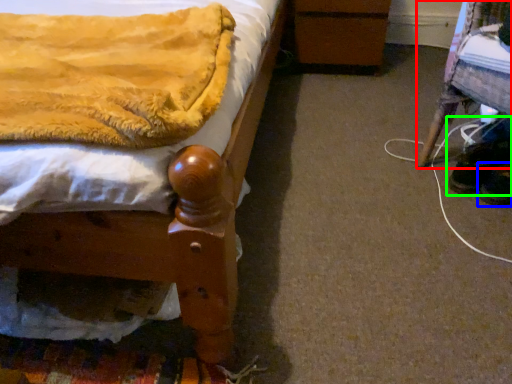
Question: Based on their relative distances, which object is farther from furniture (highlighted by a red box)? Choose from footwear (highlighted by a blue box) and footwear (highlighted by a green box).

Choices:
 (A) footwear
 (B) footwear

Answer: (A)